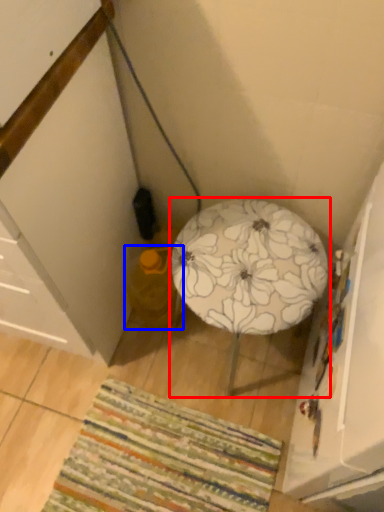
Question: Which point is further to the camera, furniture (highlighted by a red box) or bean bag chair (highlighted by a blue box)?

Choices:
 (A) furniture
 (B) bean bag chair

Answer: (B)